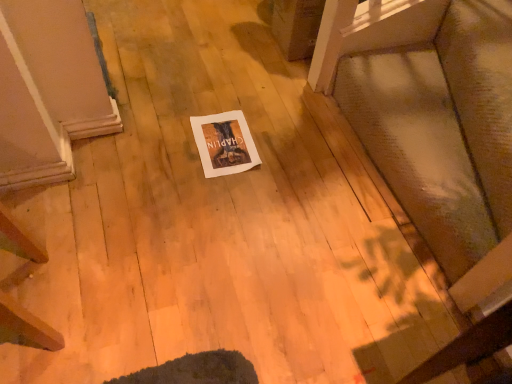
This screenshot has height=384, width=512. Find the location of `free space to the right of white paper at center`. free space to the right of white paper at center is located at coordinates (287, 148).